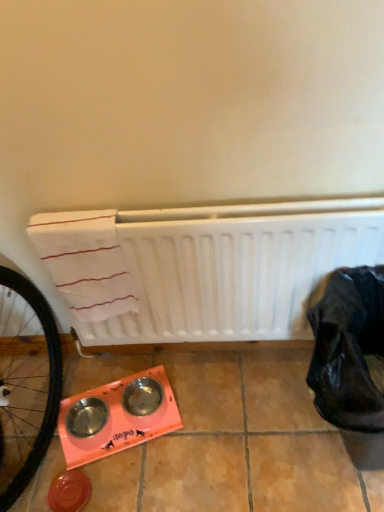
Where is `vacant space that is to the left of black fabric bag at lower right`? The image size is (384, 512). vacant space that is to the left of black fabric bag at lower right is located at coordinates (240, 438).